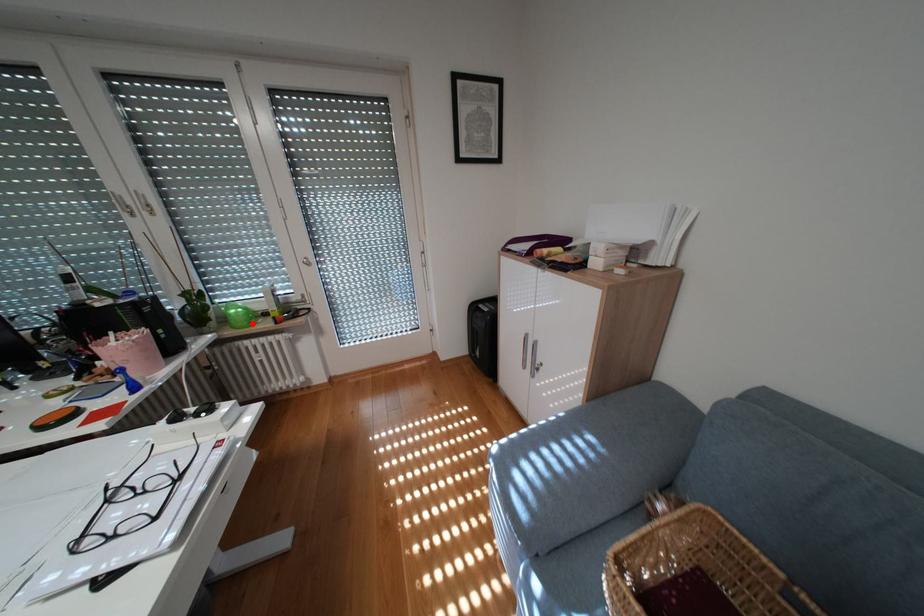
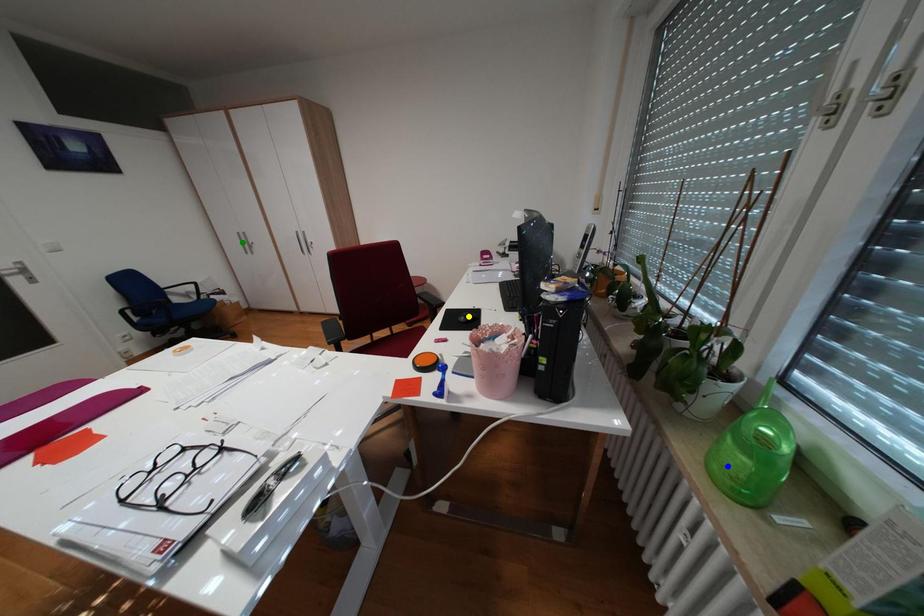
Question: I am providing you with two images of the same scene from different viewpoints. A red point is marked on the first image. You are given multiple points on the second image. Can you choose the point in image 2 that corresponds to the point in image 1?

Choices:
 (A) yellow point
 (B) green point
 (C) blue point

Answer: (C)